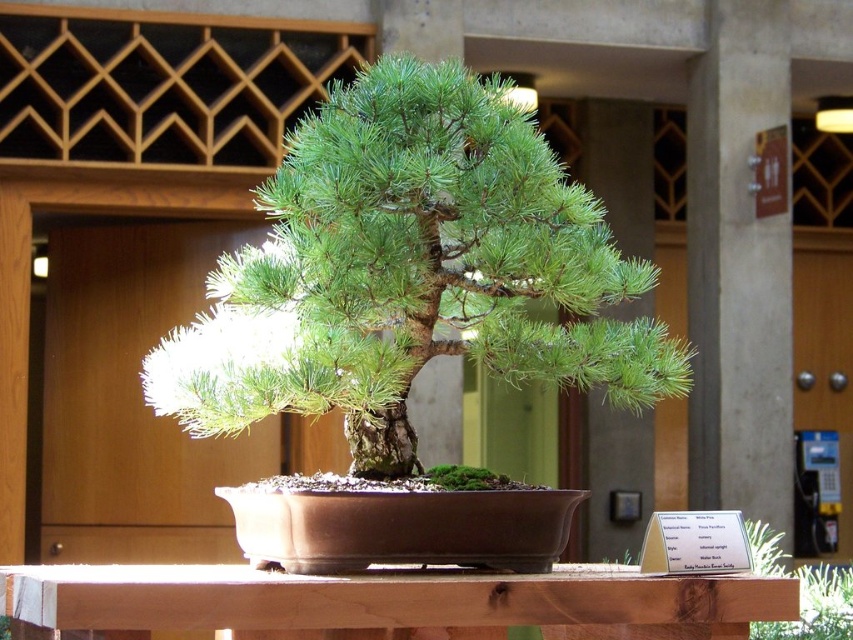
Question: Is green matte bonsai tree at center positioned in front of brown wood table at center?

Choices:
 (A) yes
 (B) no

Answer: (B)

Question: Which object is closer to the camera taking this photo?

Choices:
 (A) brown wood table at center
 (B) green matte bonsai tree at center

Answer: (A)

Question: Where is green matte bonsai tree at center located in relation to brown wood table at center in the image?

Choices:
 (A) below
 (B) above

Answer: (B)

Question: In this image, where is green matte bonsai tree at center located relative to brown wood table at center?

Choices:
 (A) right
 (B) left

Answer: (A)